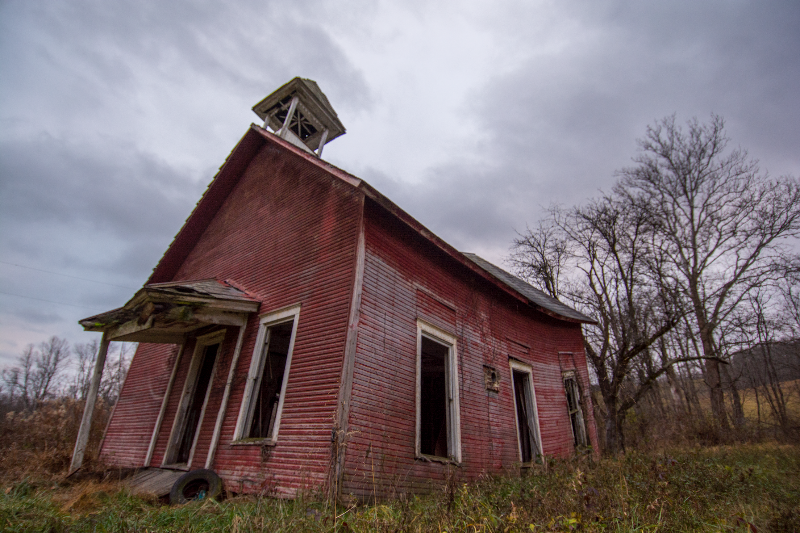
Locate an element on the screen. The height and width of the screenshot is (533, 800). door is located at coordinates (198, 370).